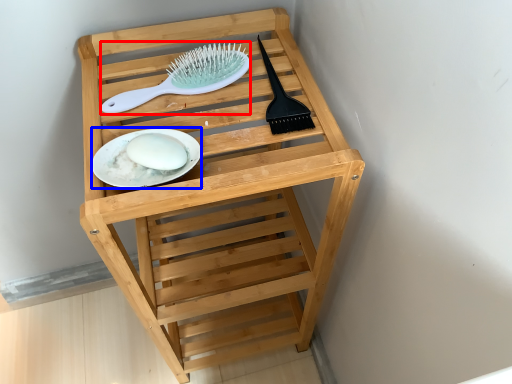
Question: Which object is further to the camera taking this photo, brush (highlighted by a red box) or plate (highlighted by a blue box)?

Choices:
 (A) brush
 (B) plate

Answer: (A)